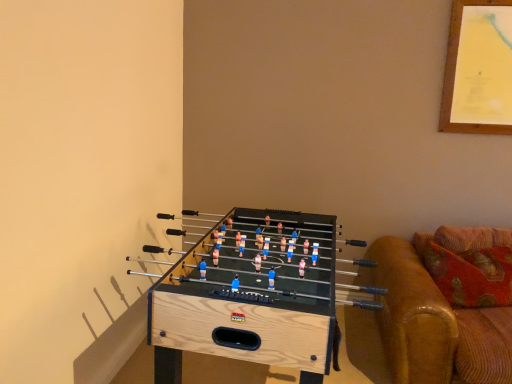
Question: Would you say natural wood foosball table at lower left is outside brown leather couch at right?

Choices:
 (A) yes
 (B) no

Answer: (A)

Question: Can you confirm if natural wood foosball table at lower left is shorter than brown leather couch at right?

Choices:
 (A) no
 (B) yes

Answer: (A)

Question: Does natural wood foosball table at lower left have a larger size compared to brown leather couch at right?

Choices:
 (A) no
 (B) yes

Answer: (B)

Question: Does natural wood foosball table at lower left lie behind brown leather couch at right?

Choices:
 (A) no
 (B) yes

Answer: (A)

Question: Can you confirm if natural wood foosball table at lower left is smaller than brown leather couch at right?

Choices:
 (A) yes
 (B) no

Answer: (B)

Question: Is natural wood foosball table at lower left at the right side of brown leather couch at right?

Choices:
 (A) no
 (B) yes

Answer: (A)

Question: Does brown leather couch at right have a lesser height compared to natural wood foosball table at lower left?

Choices:
 (A) no
 (B) yes

Answer: (B)

Question: From the image's perspective, is brown leather couch at right below natural wood foosball table at lower left?

Choices:
 (A) yes
 (B) no

Answer: (B)

Question: Is brown leather couch at right facing away from natural wood foosball table at lower left?

Choices:
 (A) yes
 (B) no

Answer: (B)

Question: Would you consider brown leather couch at right to be distant from natural wood foosball table at lower left?

Choices:
 (A) no
 (B) yes

Answer: (A)

Question: From a real-world perspective, is brown leather couch at right over natural wood foosball table at lower left?

Choices:
 (A) no
 (B) yes

Answer: (B)

Question: Does brown leather couch at right come behind natural wood foosball table at lower left?

Choices:
 (A) yes
 (B) no

Answer: (A)

Question: Is natural wood foosball table at lower left to the left or to the right of brown leather couch at right in the image?

Choices:
 (A) right
 (B) left

Answer: (B)